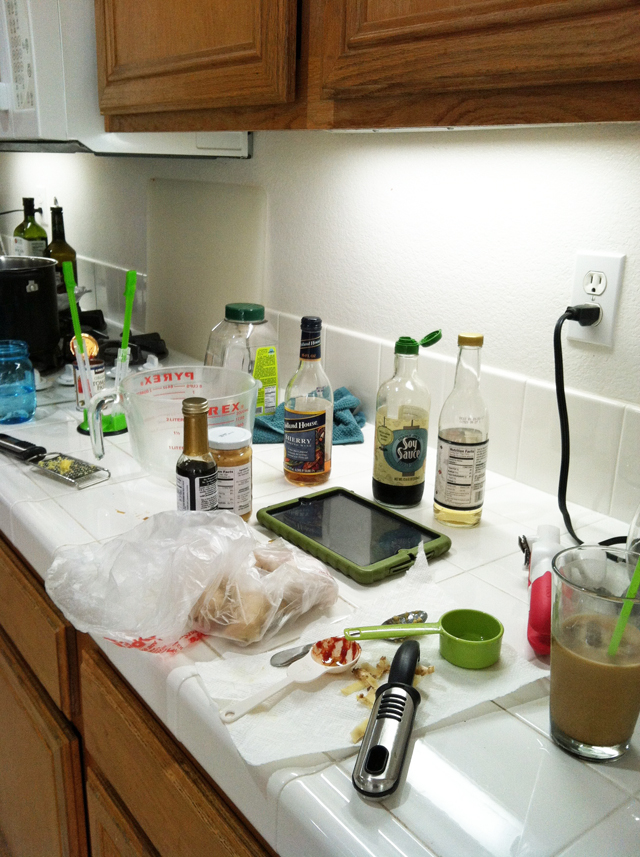
You are a GUI agent. You are given a task and a screenshot of the screen. Output one action in this format:
    pyautogui.click(x=<x>, y=<y>)
    Task: Click on the black power cord
    This screenshot has width=640, height=857.
    Given the screenshot: What is the action you would take?
    pyautogui.click(x=561, y=390)